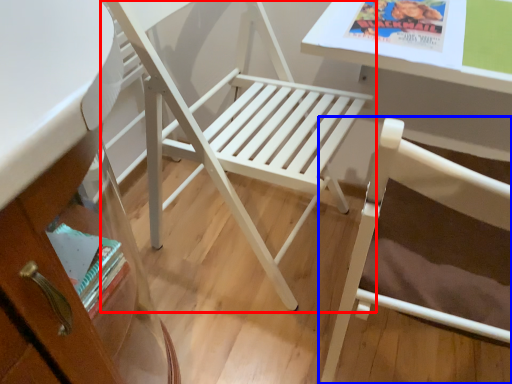
Question: Which object is closer to the camera taking this photo, chair (highlighted by a red box) or chair (highlighted by a blue box)?

Choices:
 (A) chair
 (B) chair

Answer: (B)